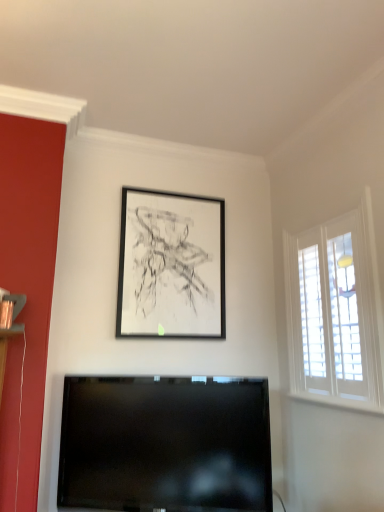
What do you see at coordinates (171, 266) in the screenshot? The width and height of the screenshot is (384, 512). I see `black matte picture frame at upper center` at bounding box center [171, 266].

Where is `black matte picture frame at upper center`? black matte picture frame at upper center is located at coordinates (171, 266).

Where is `black matte picture frame at upper center`? black matte picture frame at upper center is located at coordinates (171, 266).